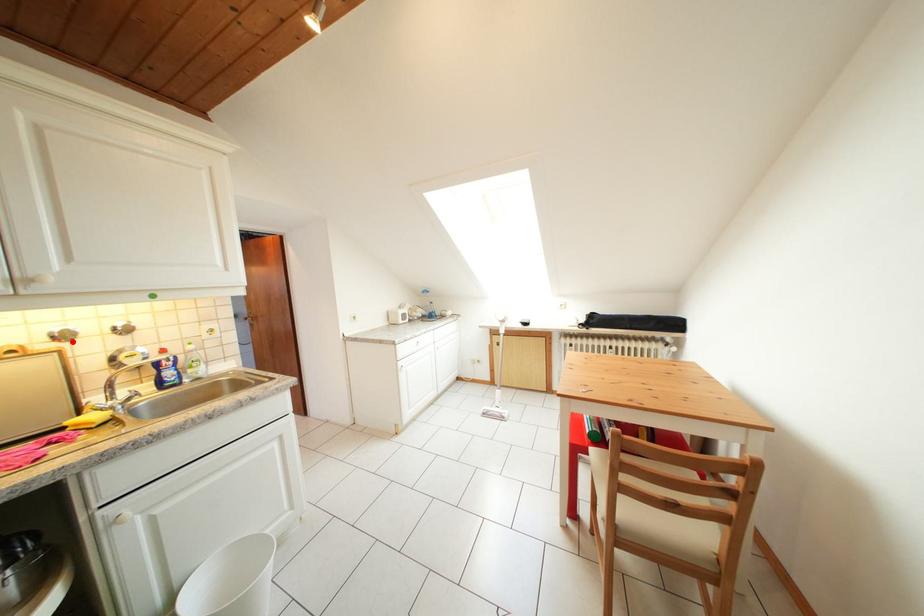
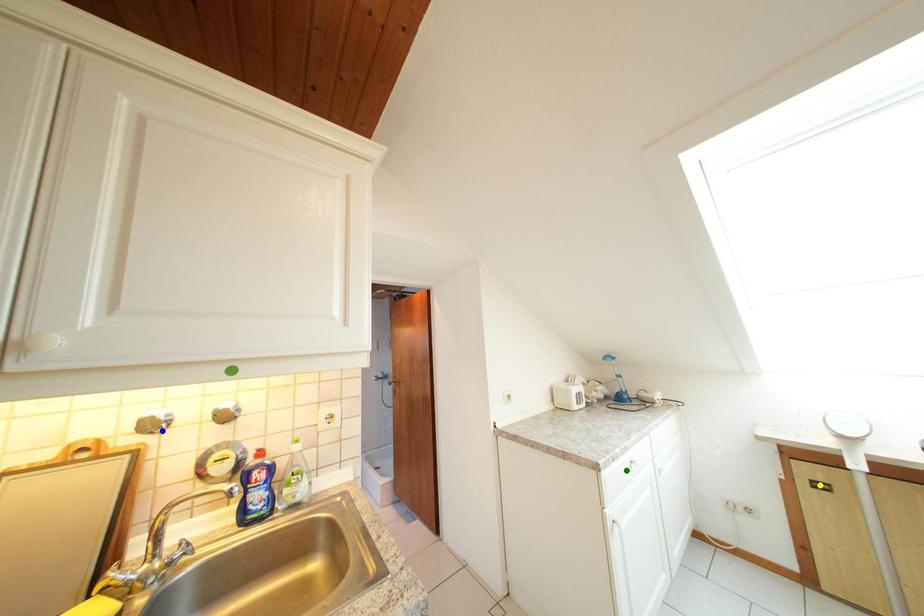
Question: I am providing you with two images of the same scene from different viewpoints. A red point is marked on the first image. You are given multiple points on the second image. In image 2, which mark is for the same physical point as the one in image 1?

Choices:
 (A) blue point
 (B) yellow point
 (C) green point

Answer: (A)